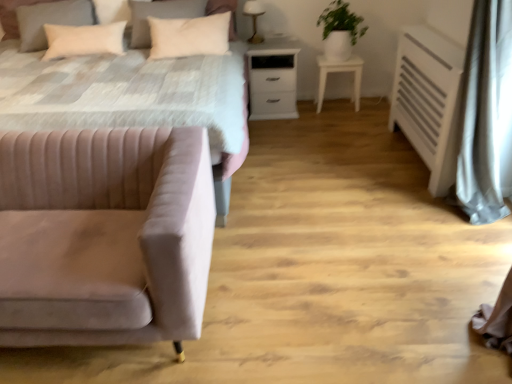
At what (x,y) coordinates should I click in order to perform the action: click on free point in front of white sheer curtain at right. Please return your answer as a coordinate pair (x, y). Image resolution: width=512 pixels, height=384 pixels. Looking at the image, I should click on (480, 263).